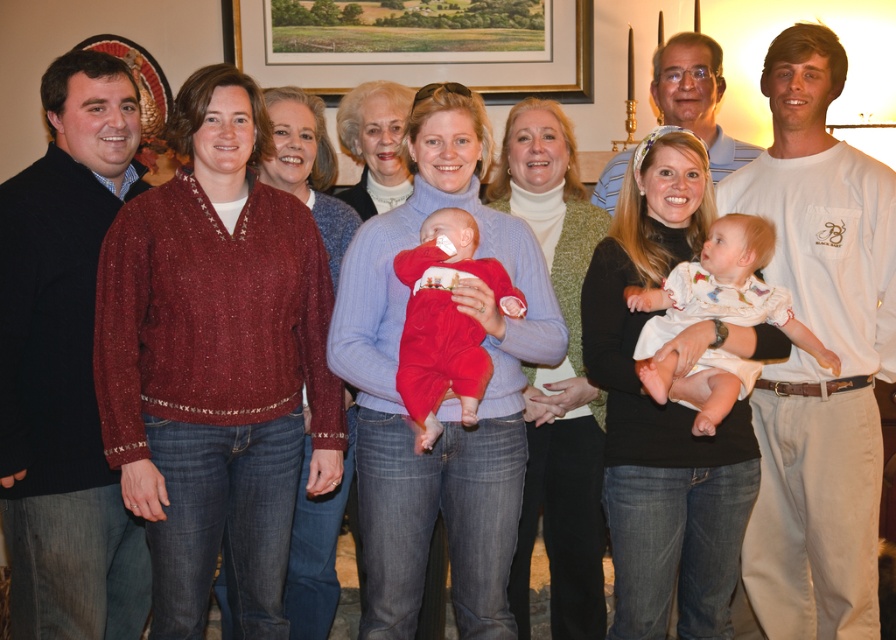
Who is higher up, matte red sweater at center or wooden picture frame at upper center?

wooden picture frame at upper center

Does point (493, 618) come in front of point (454, 60)?

Yes, point (493, 618) is closer to viewer.

Find the location of a particular element. The image size is (896, 640). matte red sweater at center is located at coordinates (448, 396).

Is wooden picture frame at upper center thinner than red fleece onesie at center?

In fact, wooden picture frame at upper center might be wider than red fleece onesie at center.

How much distance is there between wooden picture frame at upper center and red fleece onesie at center?

wooden picture frame at upper center is 7.87 feet away from red fleece onesie at center.

Between point (584, 51) and point (467, 385), which one is positioned behind?

Positioned behind is point (584, 51).

At what (x,y) coordinates should I click in order to perform the action: click on wooden picture frame at upper center. Please return your answer as a coordinate pair (x, y). Looking at the image, I should click on (428, 49).

Which is below, matte red sweater at center or red fleece onesie at center?

matte red sweater at center

The width and height of the screenshot is (896, 640). I want to click on matte red sweater at center, so click(448, 396).